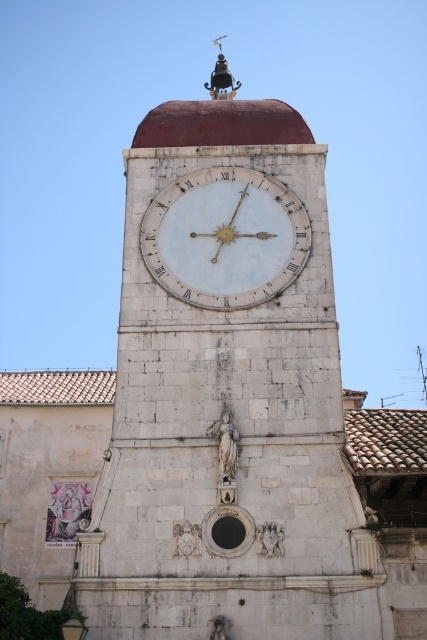
Measure the distance between white stone clock at center and camera.

A distance of 36.94 meters exists between white stone clock at center and camera.

In the scene shown: Does white stone clock at center have a smaller size compared to polished brass bell at upper center?

Actually, white stone clock at center might be larger than polished brass bell at upper center.

Which is in front, point (277, 298) or point (219, 36)?

Point (277, 298)

At what (x,y) coordinates should I click in order to perform the action: click on white stone clock at center. Please return your answer as a coordinate pair (x, y). Looking at the image, I should click on (227, 396).

At what (x,y) coordinates should I click in order to perform the action: click on white stone clock at center. Please return your answer as a coordinate pair (x, y). The height and width of the screenshot is (640, 427). Looking at the image, I should click on (227, 396).

Does white stone clock at center appear under white marble clock at center?

Indeed, white stone clock at center is positioned under white marble clock at center.

You are a GUI agent. You are given a task and a screenshot of the screen. Output one action in this format:
    pyautogui.click(x=<x>, y=<y>)
    Task: Click on the white stone clock at center
    
    Given the screenshot: What is the action you would take?
    pyautogui.click(x=227, y=396)

This screenshot has height=640, width=427. What are the coordinates of `white stone clock at center` in the screenshot? It's located at (227, 396).

Is point (239, 179) behind point (218, 88)?

No, (239, 179) is closer to viewer.

Which is above, white marble clock at center or polished brass bell at upper center?

polished brass bell at upper center is above.

Between point (297, 256) and point (233, 97), which one is positioned in front?

Point (297, 256) is more forward.

Where is `white marble clock at center`? white marble clock at center is located at coordinates (225, 237).